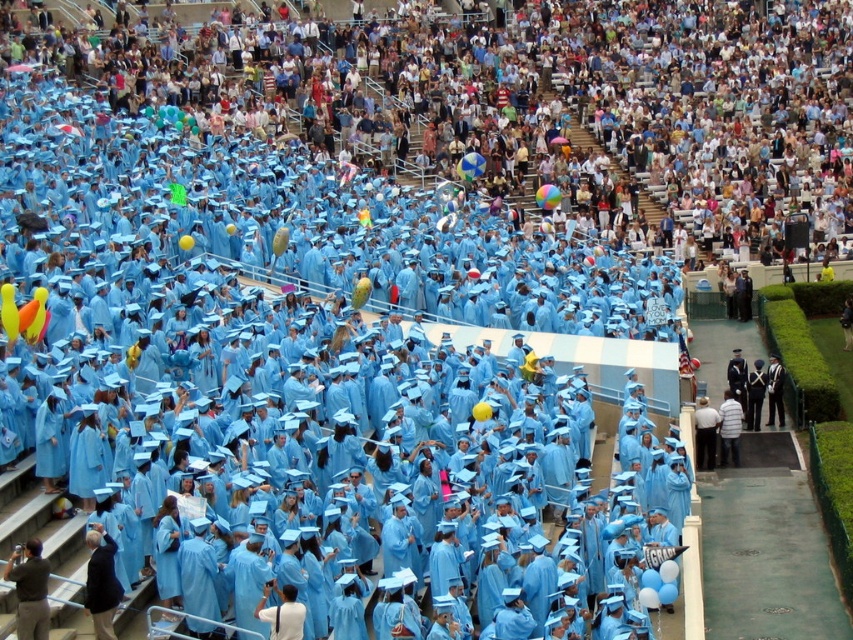
Who is lower down, dark gray uniform at lower left or black uniform at center?

dark gray uniform at lower left

Does dark gray uniform at lower left appear on the left side of black uniform at center?

Yes, dark gray uniform at lower left is to the left of black uniform at center.

Does point (33, 576) come in front of point (782, 396)?

Yes, it is in front of point (782, 396).

I want to click on dark gray uniform at lower left, so click(x=28, y=589).